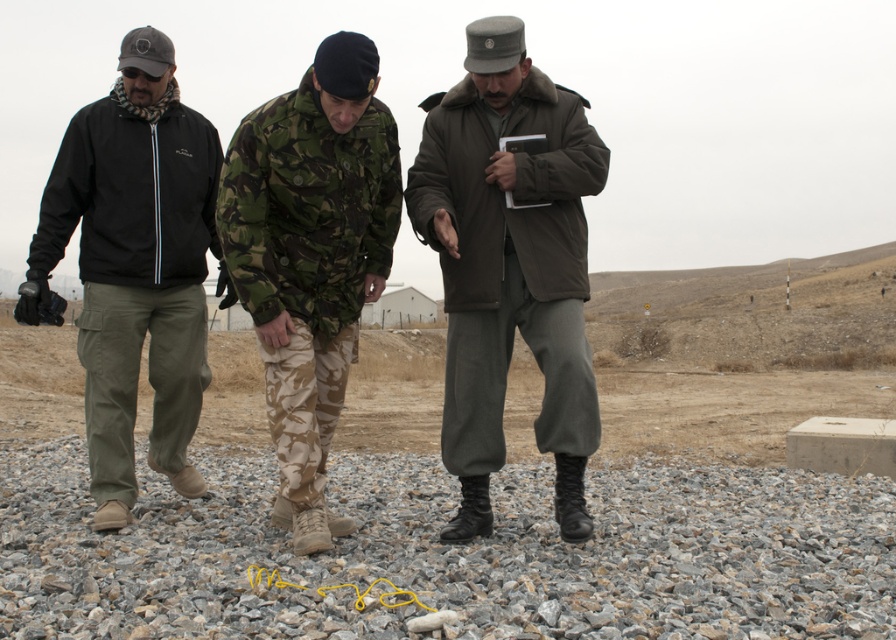
You are a photographer planning to take a group photo of the matte brown jacket at center and the matte black jacket at left. Which person should stand in the front row to ensure both are visible in the photo?

The matte brown jacket at center should stand in the front row because it is shorter than the matte black jacket at left, allowing both to be visible in the photo.

You are standing at the point marked by the coordinates point (588, 605) in the image. You want to take a photo of the three people walking in the rural area. Can you do it without moving from your current position?

The distance of point (588, 605) from viewer is 3.24 meters. Since you are at that point, you are 3.24 meters away from the viewer, but the three people are in the scene, so you can take their photo without moving.

You are a photographer trying to capture a group photo of the matte black jacket at left and the camouflage fabric uniform at center. To ensure both subjects are in focus, you need to know their vertical positions relative to each other. Which one is higher up in the frame?

The matte black jacket at left is above the camouflage fabric uniform at center, so it is higher up in the frame.